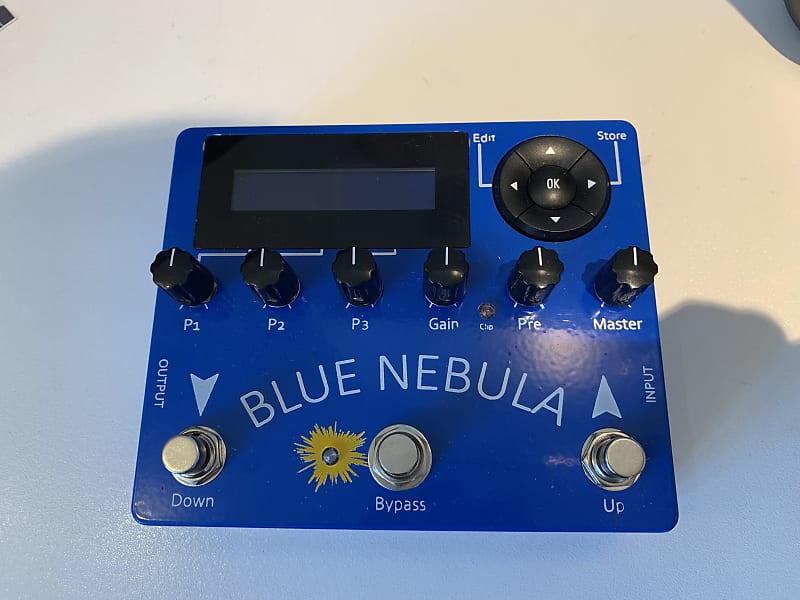
Find the location of a particular element. The width and height of the screenshot is (800, 600). lcd display is located at coordinates (265, 188).